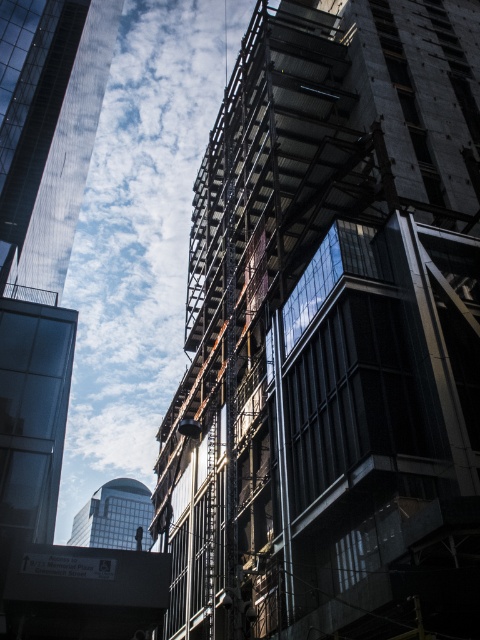
Can you confirm if concrete scaffolding at center is bigger than transparent glass skyscraper at left?

Indeed, concrete scaffolding at center has a larger size compared to transparent glass skyscraper at left.

Which of these two, concrete scaffolding at center or transparent glass skyscraper at left, stands taller?

Standing taller between the two is transparent glass skyscraper at left.

Find the location of a particular element. concrete scaffolding at center is located at coordinates (332, 336).

Is point (459, 32) closer to viewer compared to point (124, 522)?

Yes, point (459, 32) is closer to viewer.

Does concrete scaffolding at center have a larger size compared to matte glass tower at center?

No, concrete scaffolding at center is not bigger than matte glass tower at center.

What do you see at coordinates (332, 336) in the screenshot?
I see `concrete scaffolding at center` at bounding box center [332, 336].

I want to click on concrete scaffolding at center, so click(x=332, y=336).

Does transparent glass skyscraper at left appear over matte glass tower at center?

Yes.

Does transparent glass skyscraper at left have a greater width compared to matte glass tower at center?

Incorrect, transparent glass skyscraper at left's width does not surpass matte glass tower at center's.

Find the location of a particular element. transparent glass skyscraper at left is located at coordinates (48, 129).